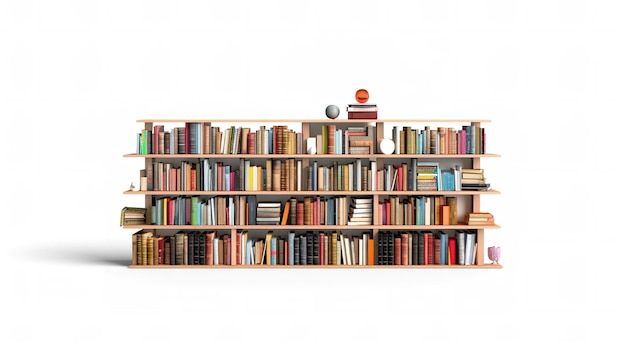
Generate point markers for all how many sections are included in this bookshelf? in the image. Your answer should be formatted as a list of tuples, i.e. [(x1, y1), (x2, y2), ...], where each tuple contains the x and y coordinates of a point satisfying the conditions above.

[(300, 137), (317, 174), (310, 208), (432, 208), (407, 247), (293, 246), (196, 242)]